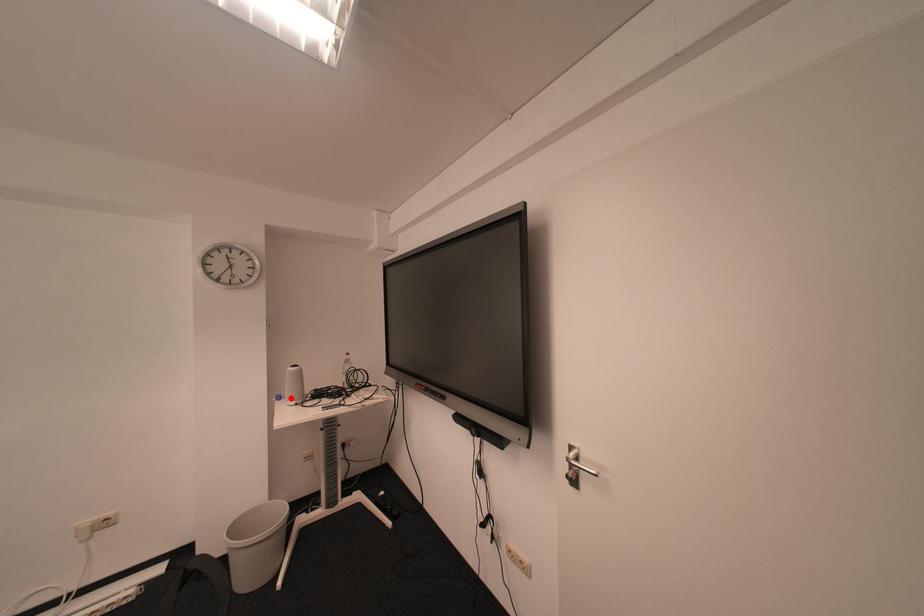
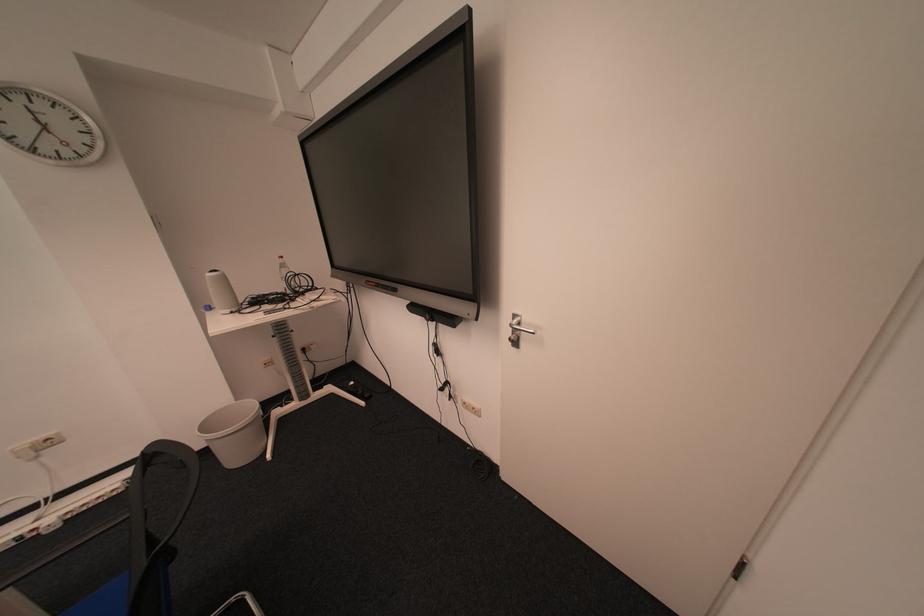
In the second image, find the point that corresponds to the highlighted location in the first image.

(221, 309)